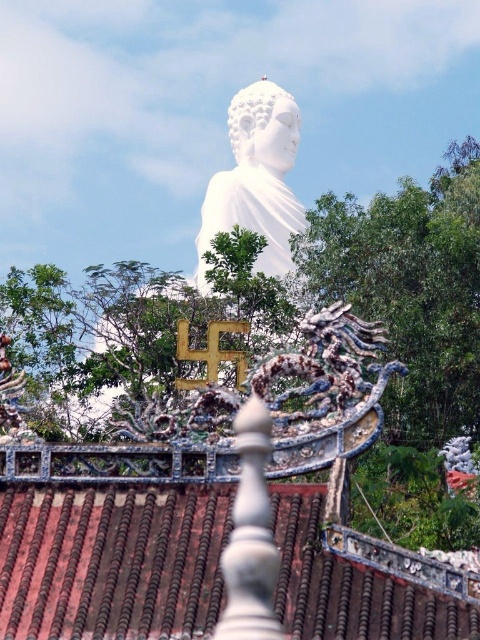
Question: Is brown tile roof at center further to camera compared to white marble statue at center?

Choices:
 (A) no
 (B) yes

Answer: (A)

Question: Is brown tile roof at center closer to the viewer compared to white marble statue at center?

Choices:
 (A) no
 (B) yes

Answer: (B)

Question: Is brown tile roof at center to the left of white marble statue at center from the viewer's perspective?

Choices:
 (A) yes
 (B) no

Answer: (B)